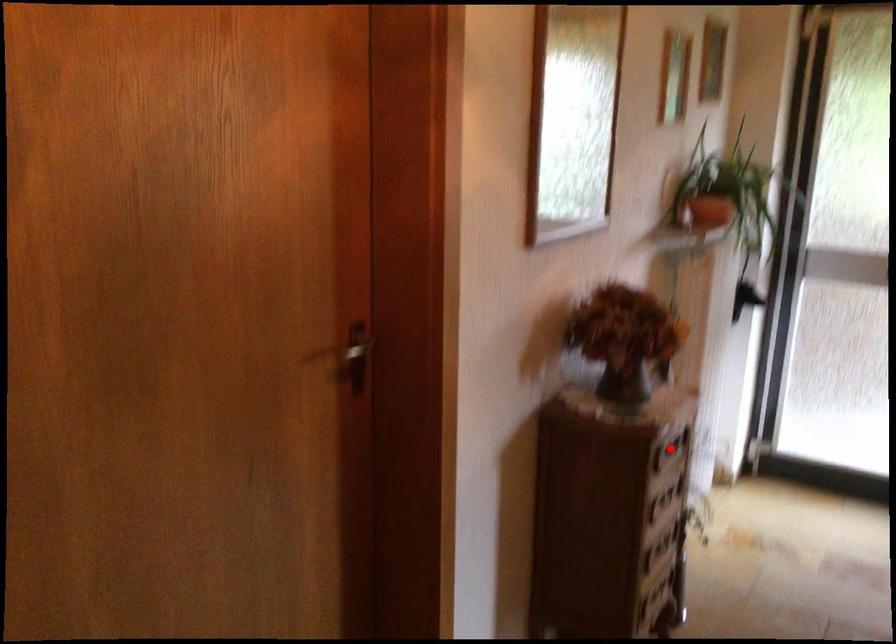
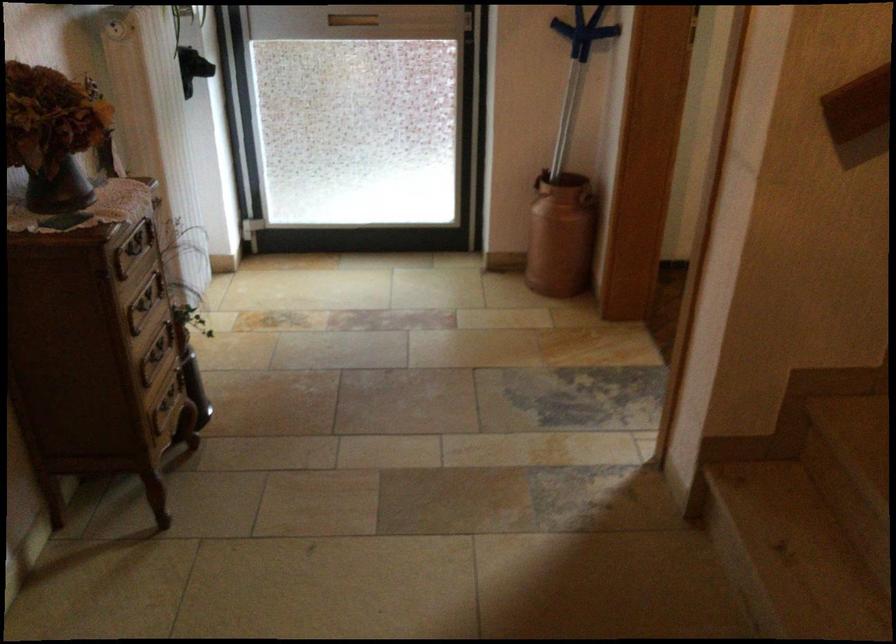
Question: A red point is marked in image1. In image2, is the corresponding 3D point closer to the camera or farther? Reply with the corresponding letter.

Choices:
 (A) The corresponding 3D point is closer.
 (B) The corresponding 3D point is farther.

Answer: (A)